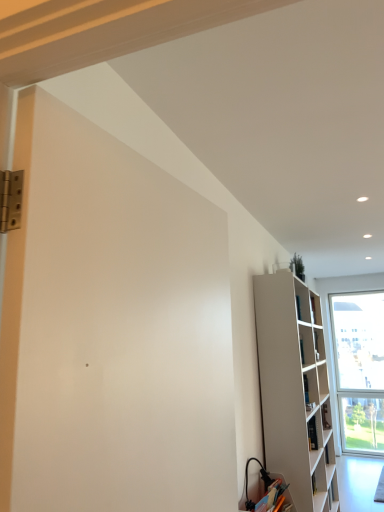
Question: Considering the positions of matte white cabinet at lower right and white matte bookshelf at right in the image, is matte white cabinet at lower right taller or shorter than white matte bookshelf at right?

Choices:
 (A) short
 (B) tall

Answer: (A)

Question: Is matte white cabinet at lower right inside the boundaries of white matte bookshelf at right, or outside?

Choices:
 (A) outside
 (B) inside

Answer: (A)

Question: Which object is positioned closest to the white matte screen door at left?

Choices:
 (A) matte white cabinet at lower right
 (B) white matte bookshelf at right

Answer: (A)

Question: Which is farther from the white matte screen door at left?

Choices:
 (A) matte white cabinet at lower right
 (B) white matte bookshelf at right

Answer: (B)